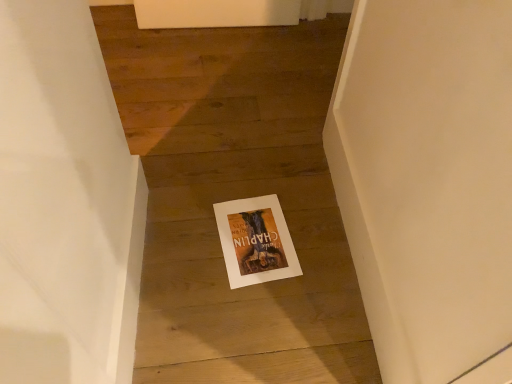
This screenshot has width=512, height=384. I want to click on empty space that is ontop of white paper at center (from a real-world perspective), so click(x=253, y=234).